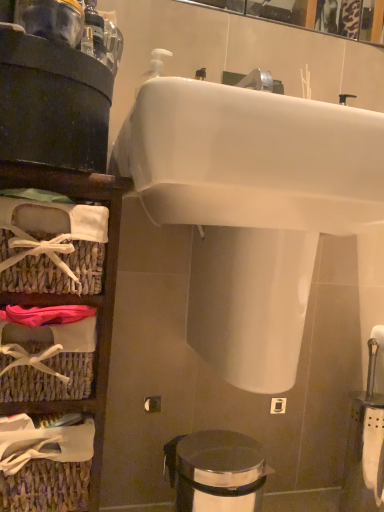
The height and width of the screenshot is (512, 384). What do you see at coordinates (82, 297) in the screenshot?
I see `woven wicker basket at left` at bounding box center [82, 297].

In order to face white glossy sink at upper center, should I rotate leftwards or rightwards?

Rotate right and turn 12.648 degrees.

This screenshot has width=384, height=512. In order to click on woven wicker basket at left in this screenshot , I will do `click(82, 297)`.

Is white glossy sink at upper center oriented away from woven wicker basket at left?

No, white glossy sink at upper center's orientation is not away from woven wicker basket at left.

Does white glossy sink at upper center contain woven wicker basket at left?

That's incorrect, woven wicker basket at left is not inside white glossy sink at upper center.

Considering the relative sizes of white glossy sink at upper center and woven wicker basket at left in the image provided, is white glossy sink at upper center smaller than woven wicker basket at left?

Actually, white glossy sink at upper center might be larger than woven wicker basket at left.

Who is taller, polished stainless steel trash can at lower center or white glossy sink at upper center?

white glossy sink at upper center is taller.

Does point (197, 457) appear closer or farther from the camera than point (184, 93)?

Point (197, 457) is positioned farther from the camera compared to point (184, 93).

From a real-world perspective, which object stands above the other?

In real-world perspective, white glossy sink at upper center is above.

Is woven wicker basket at left beside polished stainless steel trash can at lower center?

No, woven wicker basket at left is not touching polished stainless steel trash can at lower center.

Is woven wicker basket at left positioned before polished stainless steel trash can at lower center?

Yes, woven wicker basket at left is in front of polished stainless steel trash can at lower center.

Find the location of a particular element. Image resolution: width=384 pixels, height=512 pixels. trash bin/can below the woven wicker basket at left (from the image's perspective) is located at coordinates (216, 471).

From a real-world perspective, is woven wicker basket at left located higher than polished stainless steel trash can at lower center?

Correct, in the physical world, woven wicker basket at left is higher than polished stainless steel trash can at lower center.

Does point (291, 129) come in front of point (203, 494)?

Yes, it is.

Consider the image. Could you tell me if white glossy sink at upper center is facing polished stainless steel trash can at lower center?

No, white glossy sink at upper center is not oriented towards polished stainless steel trash can at lower center.

Between white glossy sink at upper center and polished stainless steel trash can at lower center, which one is positioned in front?

white glossy sink at upper center is more forward.

How distant is polished stainless steel trash can at lower center from woven wicker basket at left?

polished stainless steel trash can at lower center and woven wicker basket at left are 27.08 centimeters apart.

Which object is thinner, polished stainless steel trash can at lower center or woven wicker basket at left?

With smaller width is polished stainless steel trash can at lower center.

From the image's perspective, is polished stainless steel trash can at lower center above or below woven wicker basket at left?

Clearly, from the image's perspective, polished stainless steel trash can at lower center is below woven wicker basket at left.

Can you confirm if woven wicker basket at left is bigger than white glossy sink at upper center?

No, woven wicker basket at left is not bigger than white glossy sink at upper center.

Could white glossy sink at upper center be considered to be inside woven wicker basket at left?

Definitely not — white glossy sink at upper center is not inside woven wicker basket at left.

How many degrees apart are the facing directions of woven wicker basket at left and white glossy sink at upper center?

woven wicker basket at left and white glossy sink at upper center are facing 0.128 degrees away from each other.

Locate an element on the screen. This screenshot has width=384, height=512. sink located in front of the woven wicker basket at left is located at coordinates (251, 208).

This screenshot has height=512, width=384. In order to click on trash bin/can behind the white glossy sink at upper center in this screenshot , I will do `click(216, 471)`.

From the image, which object appears to be nearer to woven wicker basket at left, white glossy sink at upper center or polished stainless steel trash can at lower center?

Among the two, white glossy sink at upper center is located nearer to woven wicker basket at left.

Based on their spatial positions, is woven wicker basket at left or polished stainless steel trash can at lower center closer to white glossy sink at upper center?

woven wicker basket at left is closer to white glossy sink at upper center.

Based on their spatial positions, is polished stainless steel trash can at lower center or white glossy sink at upper center further from woven wicker basket at left?

polished stainless steel trash can at lower center lies further to woven wicker basket at left than the other object.

Estimate the real-world distances between objects in this image. Which object is further from polished stainless steel trash can at lower center, woven wicker basket at left or white glossy sink at upper center?

white glossy sink at upper center lies further to polished stainless steel trash can at lower center than the other object.

When comparing their distances from white glossy sink at upper center, does polished stainless steel trash can at lower center or woven wicker basket at left seem closer?

Among the two, woven wicker basket at left is located nearer to white glossy sink at upper center.

Consider the image. Looking at the image, which one is located closer to polished stainless steel trash can at lower center, white glossy sink at upper center or woven wicker basket at left?

woven wicker basket at left lies closer to polished stainless steel trash can at lower center than the other object.

Locate an element on the screen. This screenshot has width=384, height=512. shelf that lies between white glossy sink at upper center and polished stainless steel trash can at lower center from top to bottom is located at coordinates (82, 297).